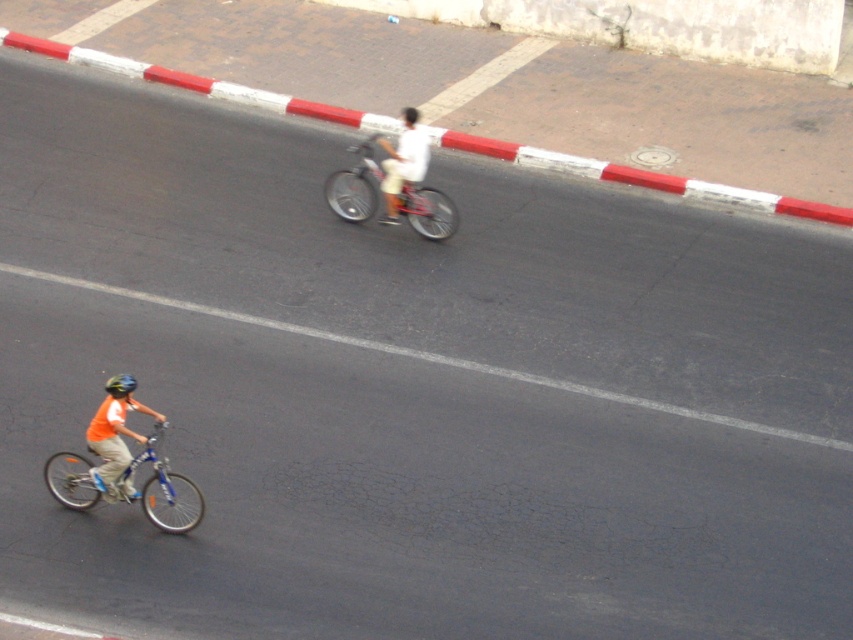
You are a pedestrian standing on the sidewalk next to the road. You see the metallic silver bicycle at center and the white matte shirt at center. Which object is closer to the road surface?

The metallic silver bicycle at center is closer to the road surface because it is positioned below the white matte shirt at center.